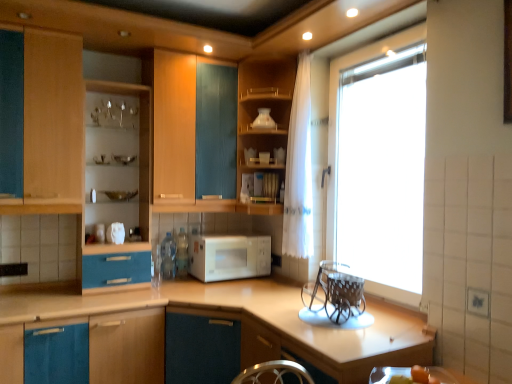
The width and height of the screenshot is (512, 384). I want to click on vacant space underneath wooden cabinet at upper center, marked as the third cabinetry in a left-to-right arrangement (from a real-world perspective), so click(270, 282).